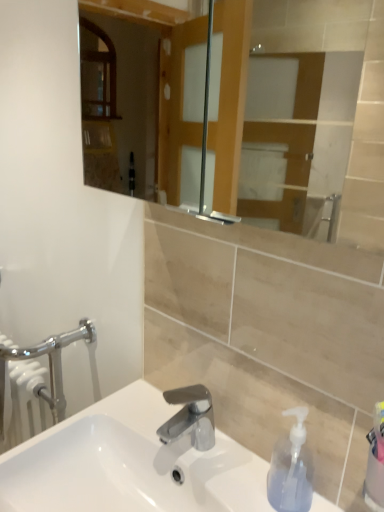
Question: Does transparent plastic soap dispenser at lower right turn towards white glossy sink at center?

Choices:
 (A) no
 (B) yes

Answer: (A)

Question: Would you say transparent plastic soap dispenser at lower right is a long distance from white glossy sink at center?

Choices:
 (A) no
 (B) yes

Answer: (A)

Question: Does transparent plastic soap dispenser at lower right appear on the left side of white glossy sink at center?

Choices:
 (A) yes
 (B) no

Answer: (B)

Question: Considering the relative sizes of transparent plastic soap dispenser at lower right and white glossy sink at center in the image provided, is transparent plastic soap dispenser at lower right thinner than white glossy sink at center?

Choices:
 (A) yes
 (B) no

Answer: (A)

Question: Can we say transparent plastic soap dispenser at lower right lies outside white glossy sink at center?

Choices:
 (A) yes
 (B) no

Answer: (A)

Question: In terms of size, does chrome metallic faucet at center appear bigger or smaller than transparent plastic soap dispenser at lower right?

Choices:
 (A) small
 (B) big

Answer: (B)

Question: From the image's perspective, is chrome metallic faucet at center positioned above or below transparent plastic soap dispenser at lower right?

Choices:
 (A) above
 (B) below

Answer: (A)

Question: Looking at their shapes, would you say chrome metallic faucet at center is wider or thinner than transparent plastic soap dispenser at lower right?

Choices:
 (A) wide
 (B) thin

Answer: (A)

Question: Based on their positions, is chrome metallic faucet at center located to the left or right of transparent plastic soap dispenser at lower right?

Choices:
 (A) right
 (B) left

Answer: (B)

Question: From the image's perspective, is white glossy sink at center positioned above or below chrome metallic faucet at center?

Choices:
 (A) above
 (B) below

Answer: (B)

Question: Looking at the image, does white glossy sink at center seem bigger or smaller compared to chrome metallic faucet at center?

Choices:
 (A) small
 (B) big

Answer: (B)

Question: Considering the positions of point (11, 492) and point (177, 402), is point (11, 492) closer or farther from the camera than point (177, 402)?

Choices:
 (A) closer
 (B) farther

Answer: (A)

Question: Is white glossy sink at center wider or thinner than chrome metallic faucet at center?

Choices:
 (A) wide
 (B) thin

Answer: (A)

Question: Is point (203, 485) positioned closer to the camera than point (286, 507)?

Choices:
 (A) closer
 (B) farther

Answer: (B)

Question: Considering the positions of white glossy sink at center and transparent plastic soap dispenser at lower right in the image, is white glossy sink at center bigger or smaller than transparent plastic soap dispenser at lower right?

Choices:
 (A) small
 (B) big

Answer: (B)